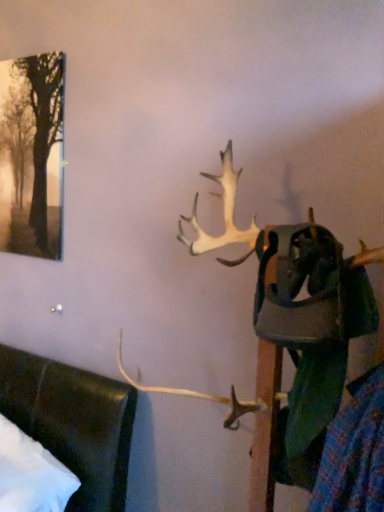
Question: Do you think silvery metallic tree at upper left is within white antler at upper center, or outside of it?

Choices:
 (A) inside
 (B) outside

Answer: (B)

Question: Relative to white antler at upper center, is silvery metallic tree at upper left in front or behind?

Choices:
 (A) front
 (B) behind

Answer: (B)

Question: In terms of size, does silvery metallic tree at upper left appear bigger or smaller than white antler at upper center?

Choices:
 (A) small
 (B) big

Answer: (A)

Question: From a real-world perspective, is white antler at upper center physically located above or below silvery metallic tree at upper left?

Choices:
 (A) below
 (B) above

Answer: (A)

Question: From the image's perspective, is white antler at upper center above or below silvery metallic tree at upper left?

Choices:
 (A) above
 (B) below

Answer: (B)

Question: From their relative heights in the image, would you say white antler at upper center is taller or shorter than silvery metallic tree at upper left?

Choices:
 (A) short
 (B) tall

Answer: (B)

Question: Is white antler at upper center situated inside silvery metallic tree at upper left or outside?

Choices:
 (A) inside
 (B) outside

Answer: (B)